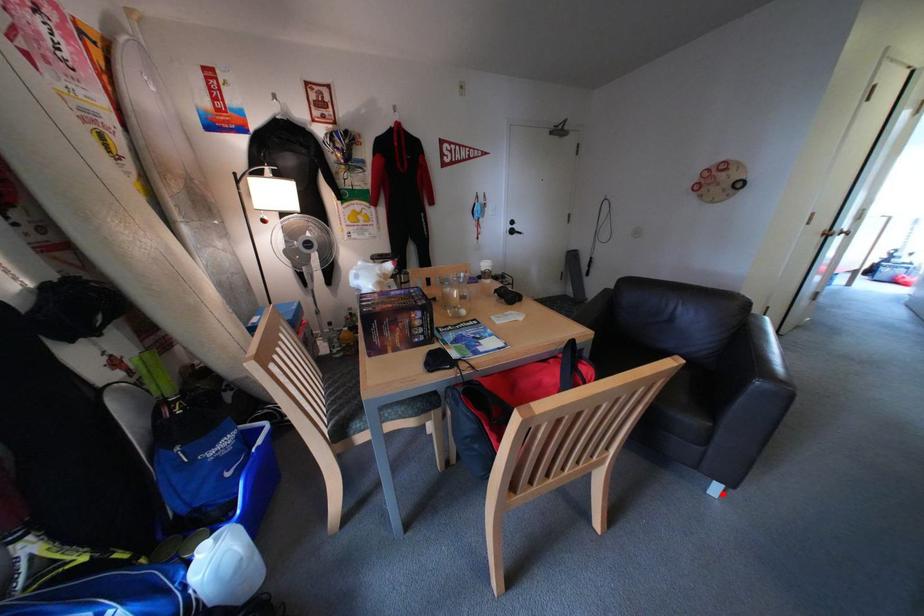
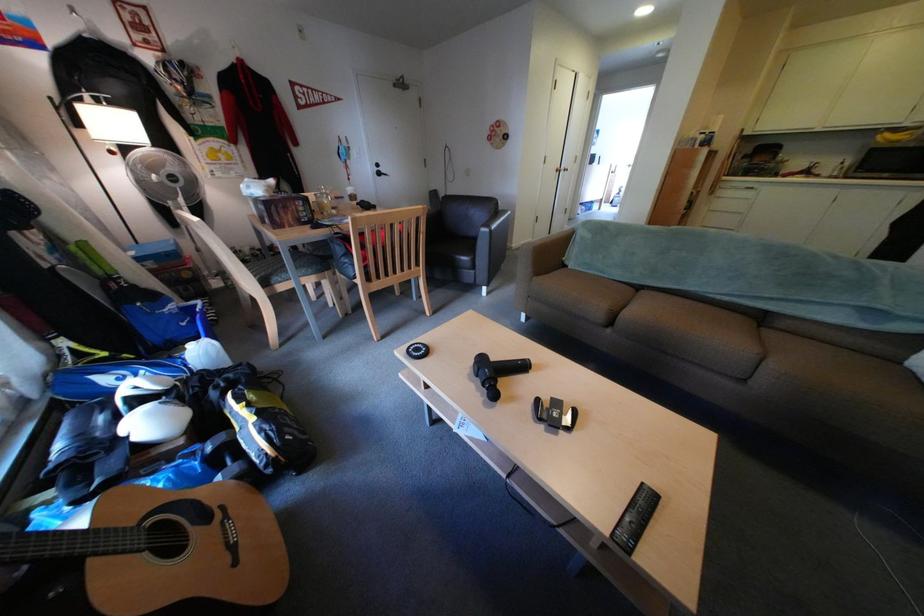
Question: I am providing you with two images of the same scene from different viewpoints. Given a red point in image1, look at the same physical point in image2. Is it:

Choices:
 (A) Closer to the viewpoint
 (B) Farther from the viewpoint

Answer: (A)